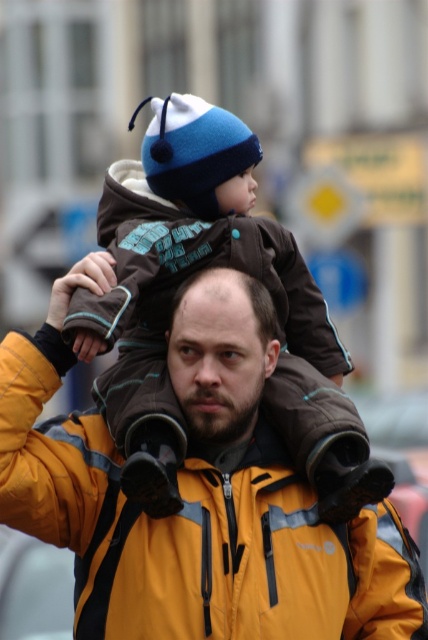
Describe the element at coordinates (196, 497) in the screenshot. I see `yellow puffy jacket at center` at that location.

Is yellow puffy jacket at center wider than brown fleece jacket at center?

Yes.

Is point (199, 470) behind point (240, 237)?

No, it is in front of (240, 237).

This screenshot has height=640, width=428. Identify the location of yellow puffy jacket at center. (196, 497).

Between yellow puffy jacket at center and dark brown hair at center, which one is positioned lower?

yellow puffy jacket at center is below.

Is yellow puffy jacket at center wider than dark brown hair at center?

Yes, yellow puffy jacket at center is wider than dark brown hair at center.

In order to click on yellow puffy jacket at center in this screenshot , I will do `click(196, 497)`.

Does brown fleece jacket at center have a lesser height compared to dark brown hair at center?

No, brown fleece jacket at center is not shorter than dark brown hair at center.

Which is more to the left, brown fleece jacket at center or dark brown hair at center?

brown fleece jacket at center

Is point (172, 172) positioned behind point (216, 413)?

Yes, point (172, 172) is behind point (216, 413).

Identify the location of brown fleece jacket at center. Image resolution: width=428 pixels, height=640 pixels. (184, 276).